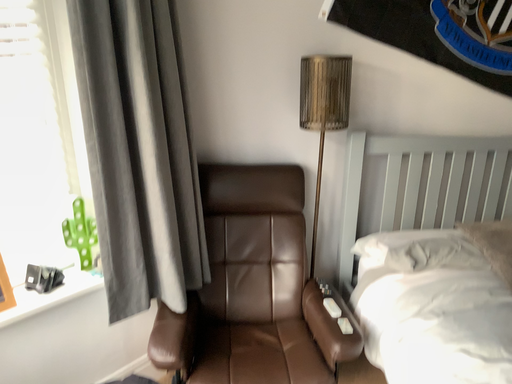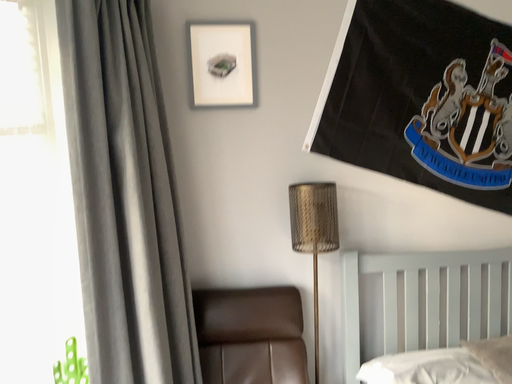
Question: Which way did the camera rotate in the video?

Choices:
 (A) rotated upward
 (B) rotated downward

Answer: (A)